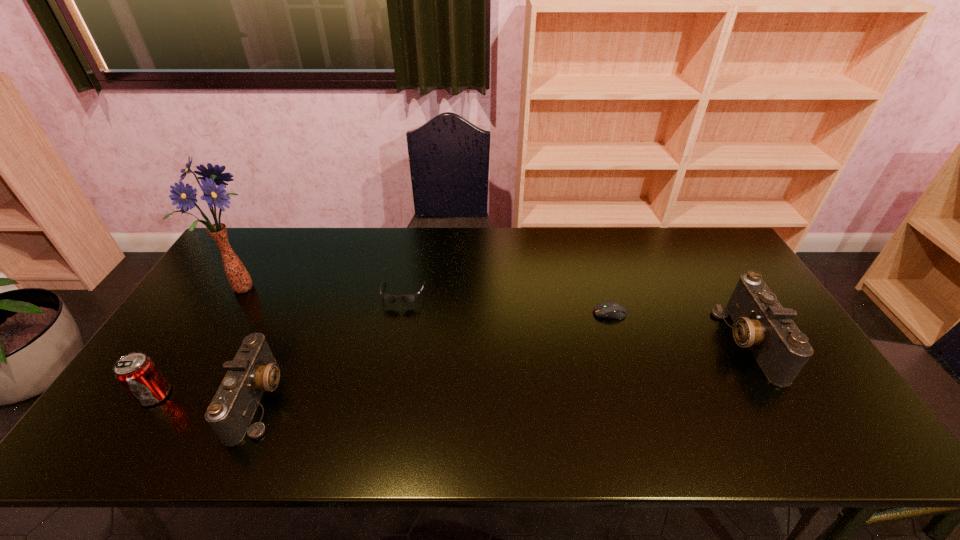
The image size is (960, 540). In order to click on blank space at the far right corner of the desktop in this screenshot , I will do `click(713, 243)`.

You are a GUI agent. You are given a task and a screenshot of the screen. Output one action in this format:
    pyautogui.click(x=<x>, y=<y>)
    Task: Click on the vacant area that lies between the fourth object from left to right and the rightmost object
    Image resolution: width=960 pixels, height=540 pixels.
    Given the screenshot: What is the action you would take?
    pyautogui.click(x=575, y=318)

Image resolution: width=960 pixels, height=540 pixels. Identify the location of free spot between the pop soda and the fifth object from left to right. (382, 354).

Where is `empty space that is in between the computer equipment and the third object from left to right`? Image resolution: width=960 pixels, height=540 pixels. empty space that is in between the computer equipment and the third object from left to right is located at coordinates (435, 356).

Locate an element on the screen. The height and width of the screenshot is (540, 960). free space between the pop soda and the shorter camera is located at coordinates (207, 397).

I want to click on empty location between the shortest object and the taller camera, so click(679, 328).

Locate an element on the screen. This screenshot has width=960, height=540. free space between the pop soda and the flower arrangement is located at coordinates (198, 341).

In order to click on free space between the pop soda and the second object from right to left in this screenshot , I will do `click(382, 354)`.

Locate an element on the screen. vacant region between the shortest object and the shorter camera is located at coordinates (435, 356).

You are a GUI agent. You are given a task and a screenshot of the screen. Output one action in this format:
    pyautogui.click(x=<x>, y=<y>)
    Task: Click on the vacant space that's between the sunglasses and the fourth object from right to left
    The width and height of the screenshot is (960, 540).
    Given the screenshot: What is the action you would take?
    pyautogui.click(x=331, y=347)